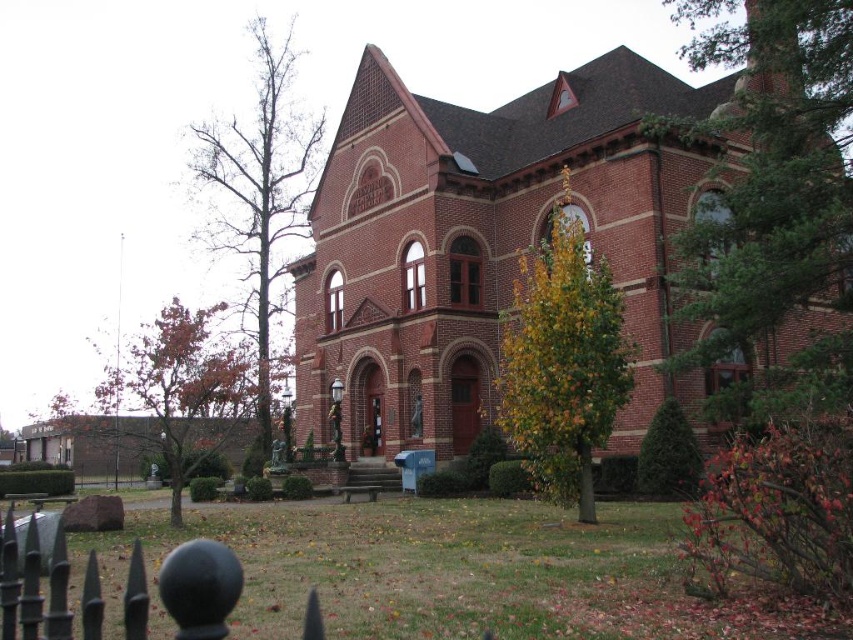
You are a landscape architect planning to install a new pathway between the red brick church at center and the black wrought iron fence at lower left. Considering their widths, which structure would require more space on the pathway side?

The red brick church at center has a greater width than the black wrought iron fence at lower left, so it would require more space on the pathway side.

You are standing at the entrance of the red brick church at center. If you walk straight ahead, will you immediately step onto the lawn or the trees?

The red brick church at center is positioned at point (x=486, y=244), so walking straight ahead from the entrance would lead you onto the lawn since the trees are located around the area but not directly in front of the church entrance.